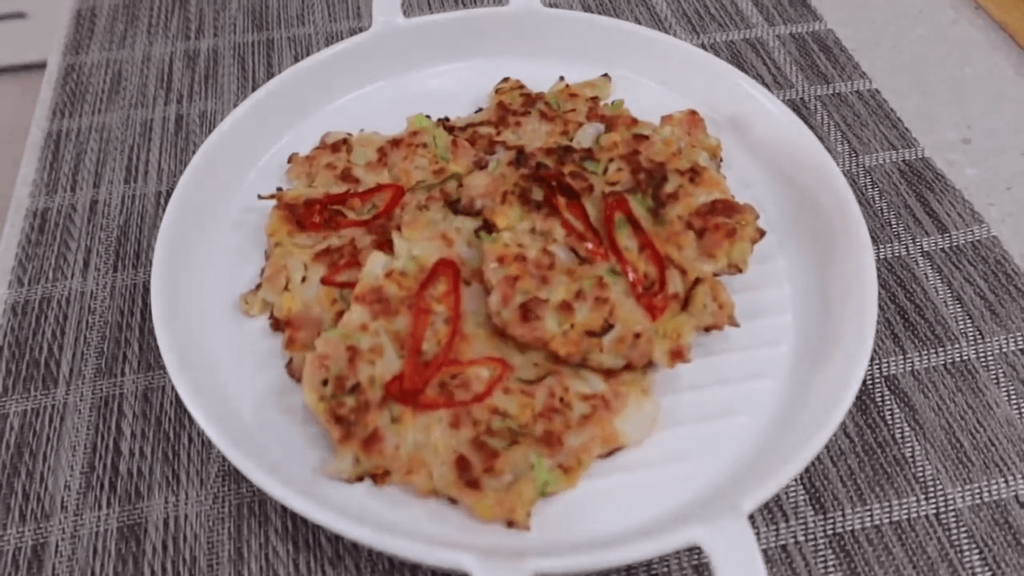
Locate an element on the screen. This screenshot has height=576, width=1024. white countertop is located at coordinates (936, 49).